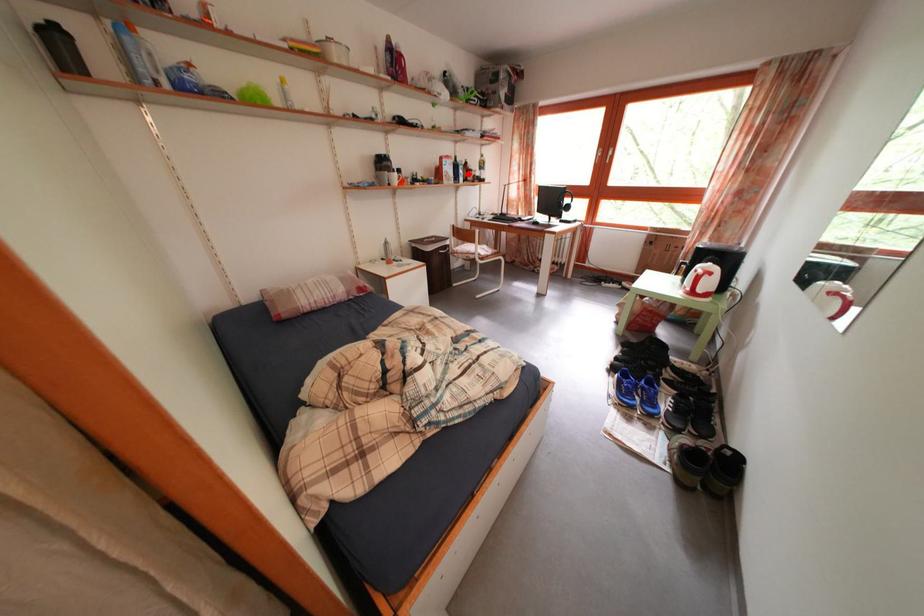
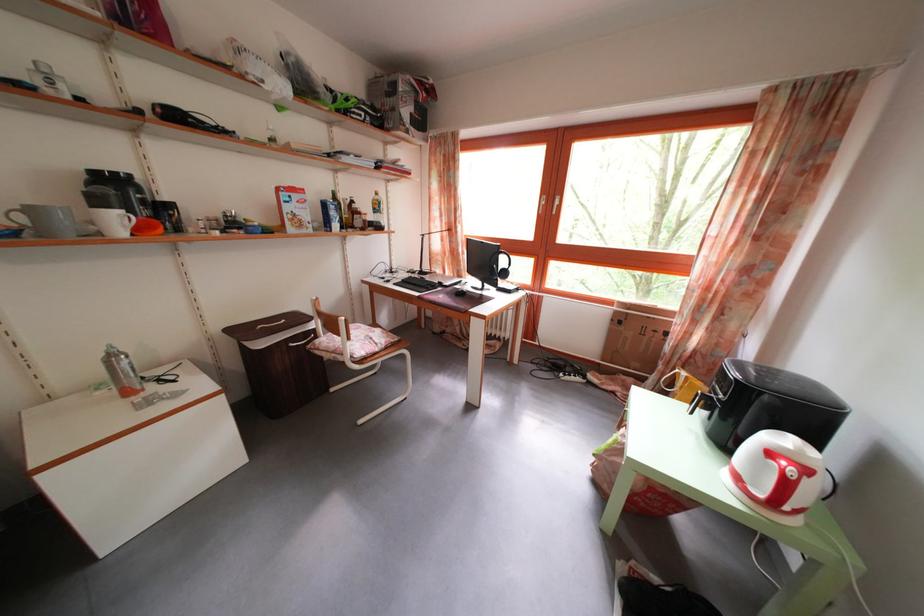
Locate, in the second image, the point that corresponds to the highlighted location in the first image.

(338, 214)